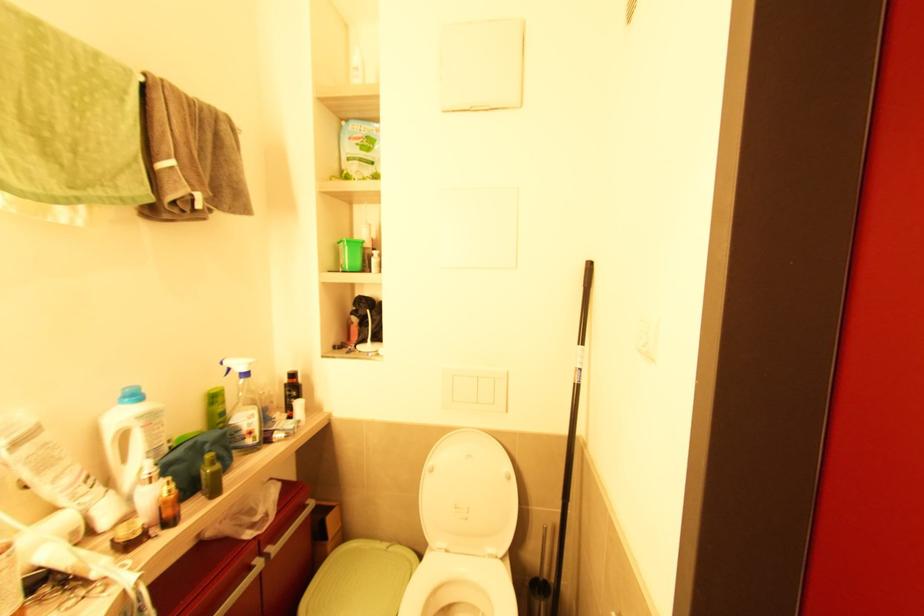
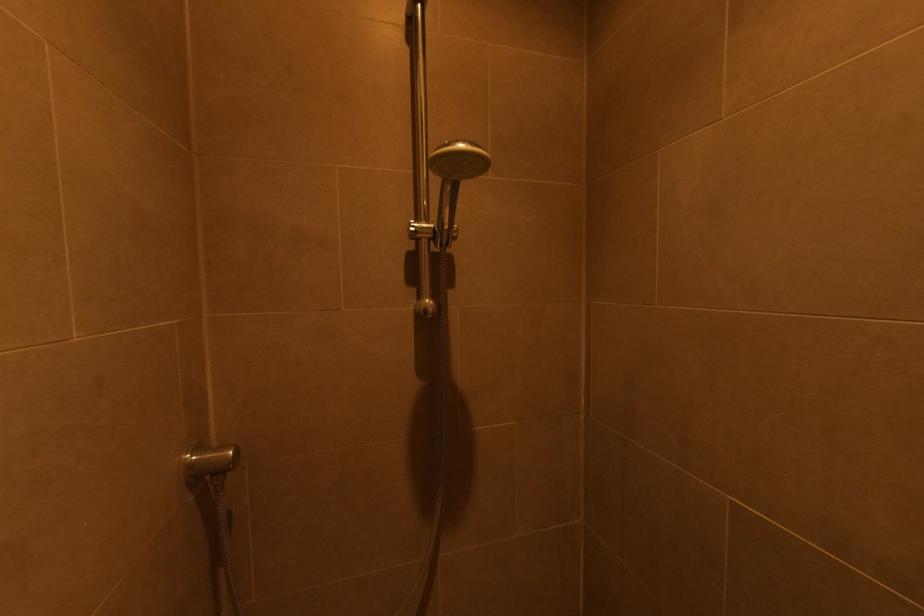
Question: The camera is either moving clockwise (left) or counter-clockwise (right) around the object. The first image is from the beginning of the video and the second image is from the end. Is the camera moving left or right when shooting the video?

Choices:
 (A) Left
 (B) Right

Answer: (B)